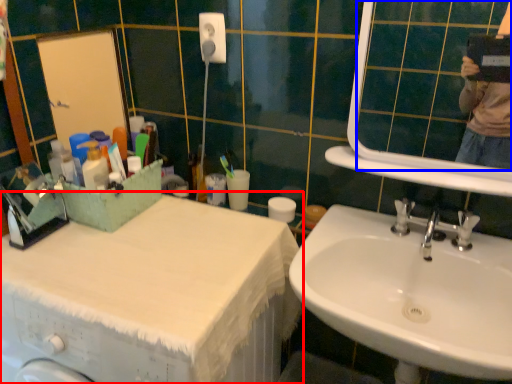
Question: Which of the following is the farthest to the observer, counter top (highlighted by a red box) or mirror (highlighted by a blue box)?

Choices:
 (A) counter top
 (B) mirror

Answer: (B)